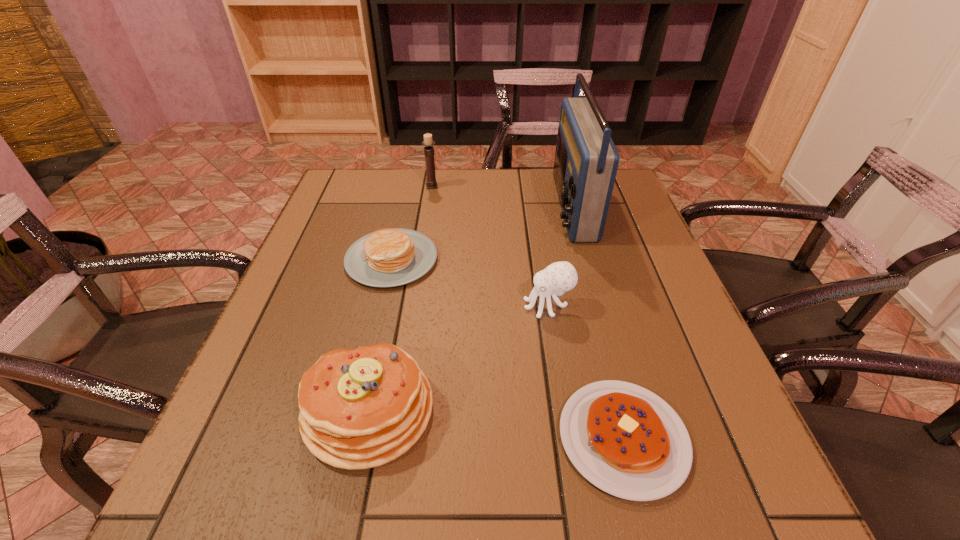
The image size is (960, 540). In order to click on radio receiver that is at the right edge in this screenshot , I will do `click(586, 160)`.

Find the location of a particular element. This screenshot has width=960, height=540. pancake that is positioned at the right edge is located at coordinates (624, 439).

Locate an element on the screen. The width and height of the screenshot is (960, 540). object that is at the near left corner is located at coordinates (362, 408).

I want to click on object that is at the far right corner, so point(586,160).

I want to click on object positioned at the near right corner, so click(x=624, y=439).

In the image, there is a desktop. Identify the location of vacant space at the far edge. This screenshot has height=540, width=960. (540, 184).

Image resolution: width=960 pixels, height=540 pixels. In the image, there is a desktop. What are the coordinates of `vacant area at the near edge` in the screenshot? It's located at (421, 489).

In the image, there is a desktop. Identify the location of free space at the left edge. (349, 246).

Where is `free space at the right edge of the desktop`? free space at the right edge of the desktop is located at coordinates (720, 454).

Locate an element on the screen. free location at the far right corner of the desktop is located at coordinates (618, 194).